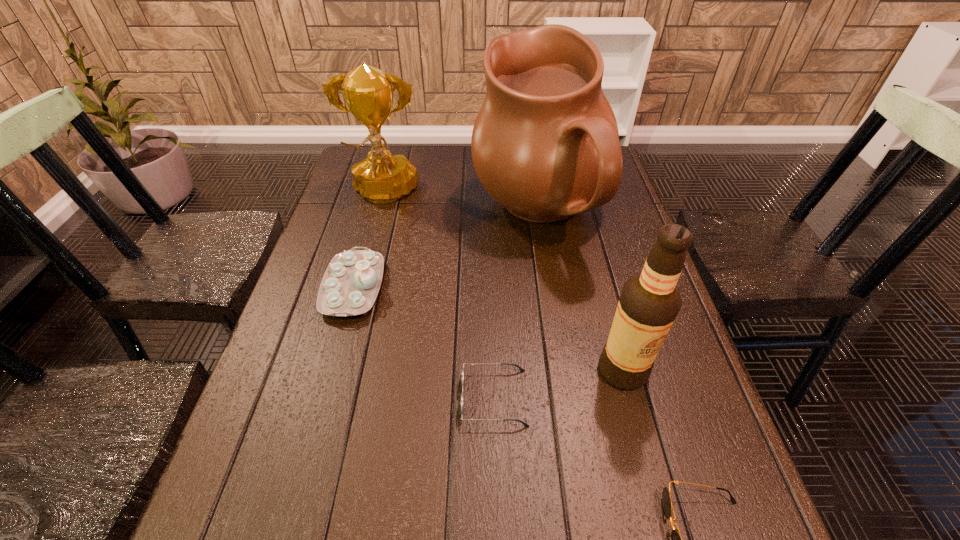
Identify the location of vacant space located on the right of the fourth tallest object. tap(436, 287).

You are a GUI agent. You are given a task and a screenshot of the screen. Output one action in this format:
    pyautogui.click(x=<x>, y=<y>)
    Task: Click on the vacant region located on the front-facing side of the farther sunglasses
    
    Given the screenshot: What is the action you would take?
    pyautogui.click(x=300, y=397)

Where is `vacant space situated on the front-facing side of the farther sunglasses`? This screenshot has height=540, width=960. vacant space situated on the front-facing side of the farther sunglasses is located at coordinates (416, 397).

At what (x,y) coordinates should I click in order to perform the action: click on vacant position located 0.260m on the front-facing side of the farther sunglasses. Please return your answer as a coordinate pair (x, y). The height and width of the screenshot is (540, 960). Looking at the image, I should click on (330, 397).

Locate an element on the screen. The image size is (960, 540). cream pitcher positioned at the far edge is located at coordinates (545, 145).

Identify the location of award present at the far edge. This screenshot has width=960, height=540. (382, 177).

Find the location of a particular element. award that is at the left edge is located at coordinates tap(382, 177).

Identify the location of chinaware present at the left edge. (351, 282).

What are the coordinates of `cream pitcher at the right edge` in the screenshot? It's located at (545, 145).

The width and height of the screenshot is (960, 540). I want to click on alcohol that is at the right edge, so click(650, 301).